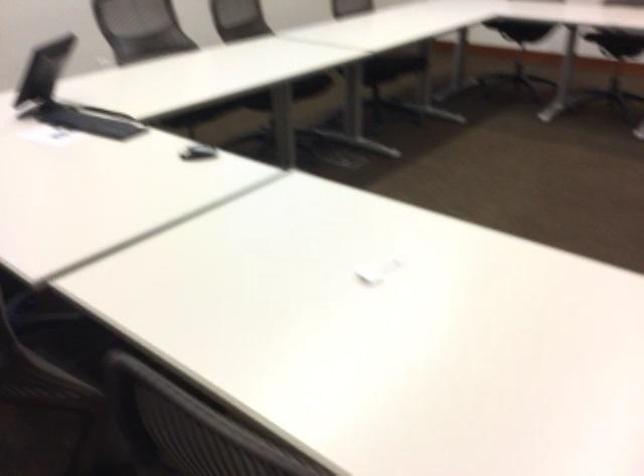
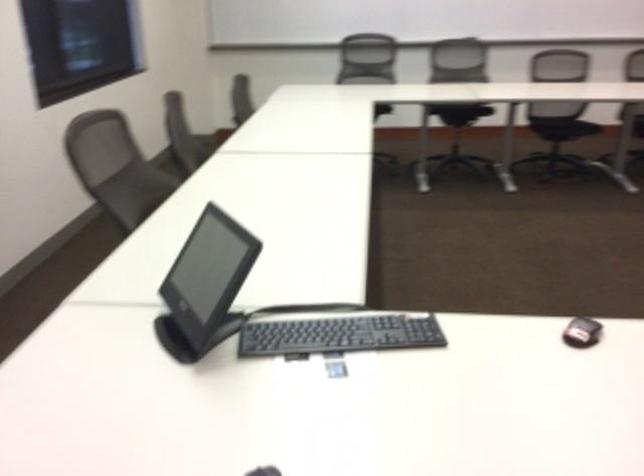
How did the camera likely rotate?

The camera rotated toward right-down.